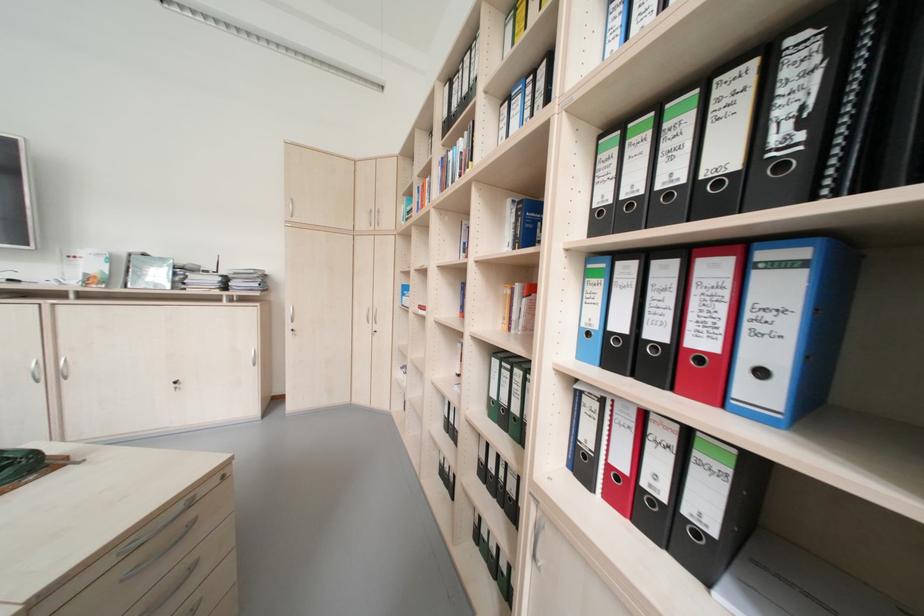
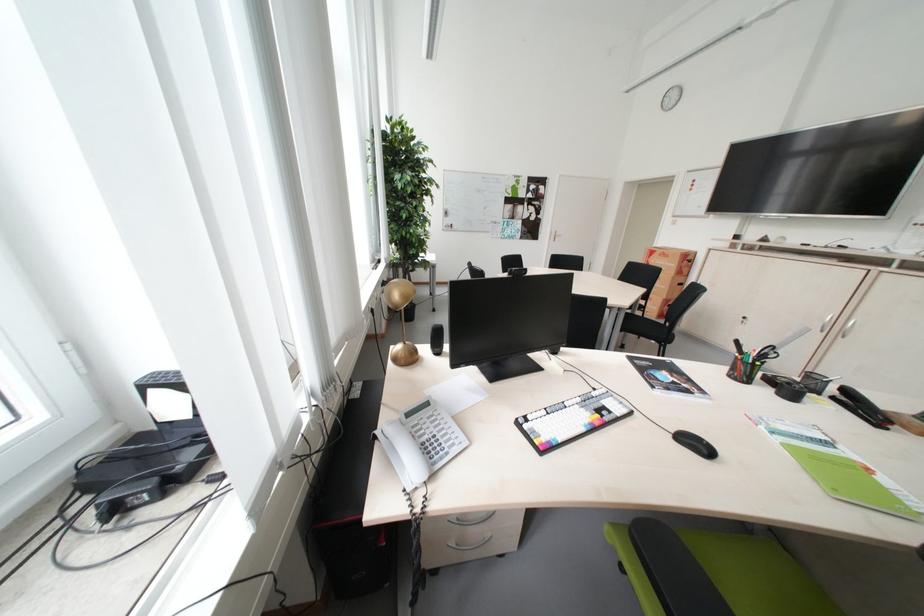
How did the camera likely rotate?

The camera's rotation is toward left-down.